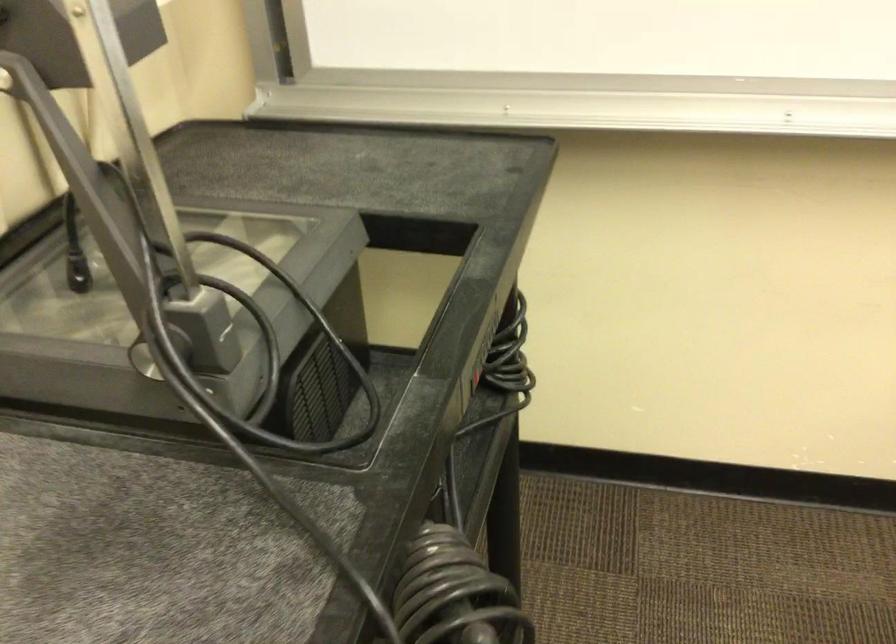
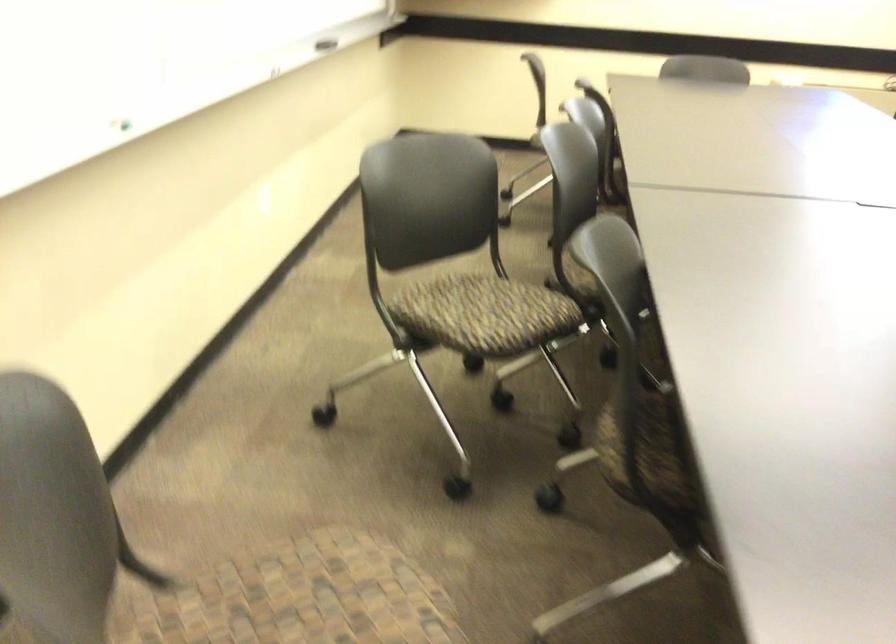
First-person continuous shooting, in which direction is the camera rotating?

The rotation direction of the camera is right-down.